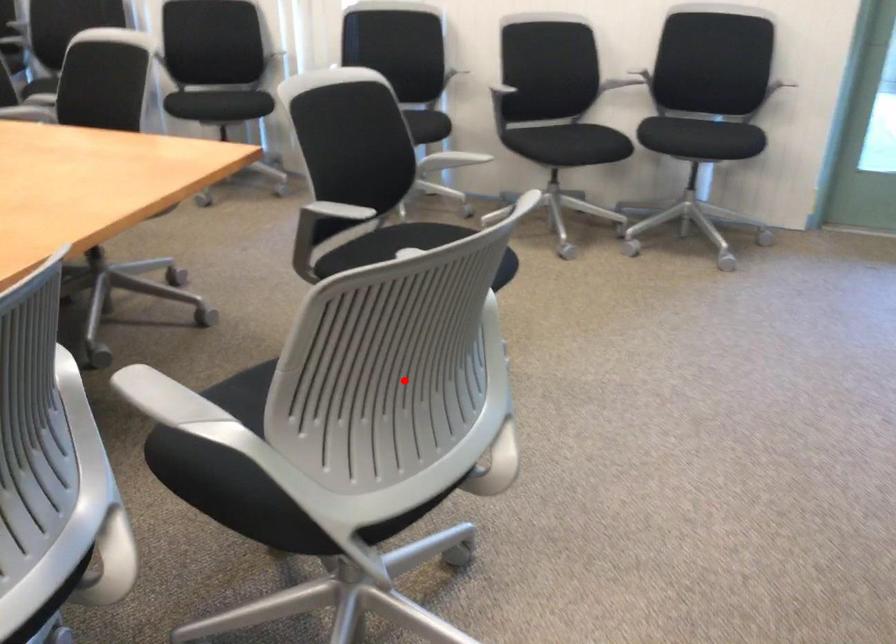
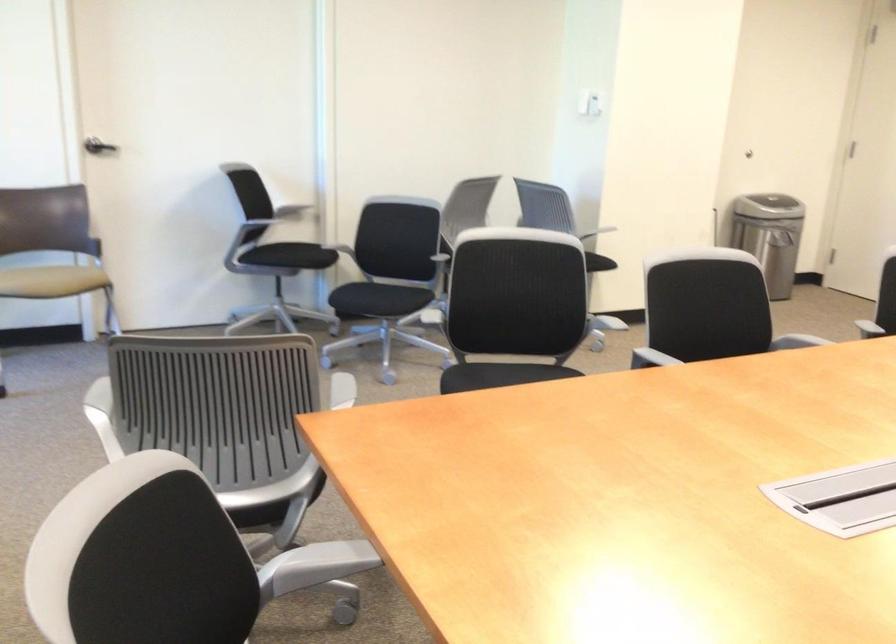
Find the pixel in the second image that matches the highlighted location in the first image.

(513, 307)